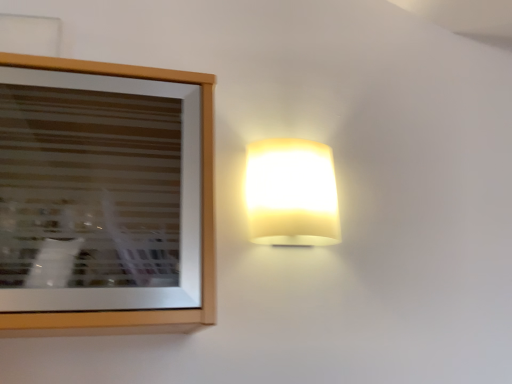
Question: From a real-world perspective, is wooden picture frame at upper left physically below matte yellow glass lamp at upper right?

Choices:
 (A) yes
 (B) no

Answer: (A)

Question: Are wooden picture frame at upper left and matte yellow glass lamp at upper right making contact?

Choices:
 (A) no
 (B) yes

Answer: (A)

Question: Is wooden picture frame at upper left to the left of matte yellow glass lamp at upper right from the viewer's perspective?

Choices:
 (A) yes
 (B) no

Answer: (A)

Question: Does wooden picture frame at upper left have a smaller size compared to matte yellow glass lamp at upper right?

Choices:
 (A) no
 (B) yes

Answer: (A)

Question: From a real-world perspective, is wooden picture frame at upper left positioned over matte yellow glass lamp at upper right based on gravity?

Choices:
 (A) no
 (B) yes

Answer: (A)

Question: Considering the relative sizes of wooden picture frame at upper left and matte yellow glass lamp at upper right in the image provided, is wooden picture frame at upper left shorter than matte yellow glass lamp at upper right?

Choices:
 (A) no
 (B) yes

Answer: (A)

Question: Could you tell me if matte yellow glass lamp at upper right is turned towards wooden picture frame at upper left?

Choices:
 (A) no
 (B) yes

Answer: (A)

Question: Considering the relative positions of matte yellow glass lamp at upper right and wooden picture frame at upper left in the image provided, is matte yellow glass lamp at upper right in front of wooden picture frame at upper left?

Choices:
 (A) no
 (B) yes

Answer: (A)

Question: Considering the relative sizes of matte yellow glass lamp at upper right and wooden picture frame at upper left in the image provided, is matte yellow glass lamp at upper right taller than wooden picture frame at upper left?

Choices:
 (A) no
 (B) yes

Answer: (A)

Question: Can you confirm if matte yellow glass lamp at upper right is shorter than wooden picture frame at upper left?

Choices:
 (A) yes
 (B) no

Answer: (A)

Question: Is matte yellow glass lamp at upper right facing away from wooden picture frame at upper left?

Choices:
 (A) no
 (B) yes

Answer: (A)

Question: Considering the relative positions of matte yellow glass lamp at upper right and wooden picture frame at upper left in the image provided, is matte yellow glass lamp at upper right to the left of wooden picture frame at upper left from the viewer's perspective?

Choices:
 (A) no
 (B) yes

Answer: (A)

Question: Considering the positions of point (275, 177) and point (163, 77), is point (275, 177) closer or farther from the camera than point (163, 77)?

Choices:
 (A) closer
 (B) farther

Answer: (B)